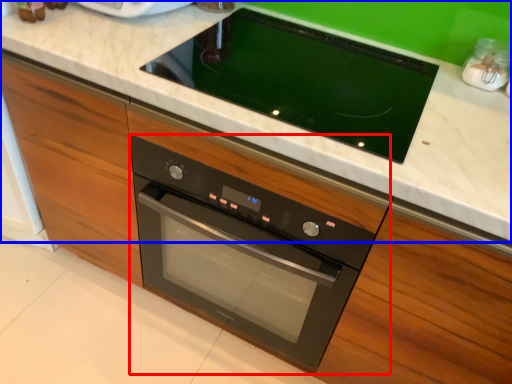
Question: Which point is further to the camera, oven (highlighted by a red box) or countertop (highlighted by a blue box)?

Choices:
 (A) oven
 (B) countertop

Answer: (A)